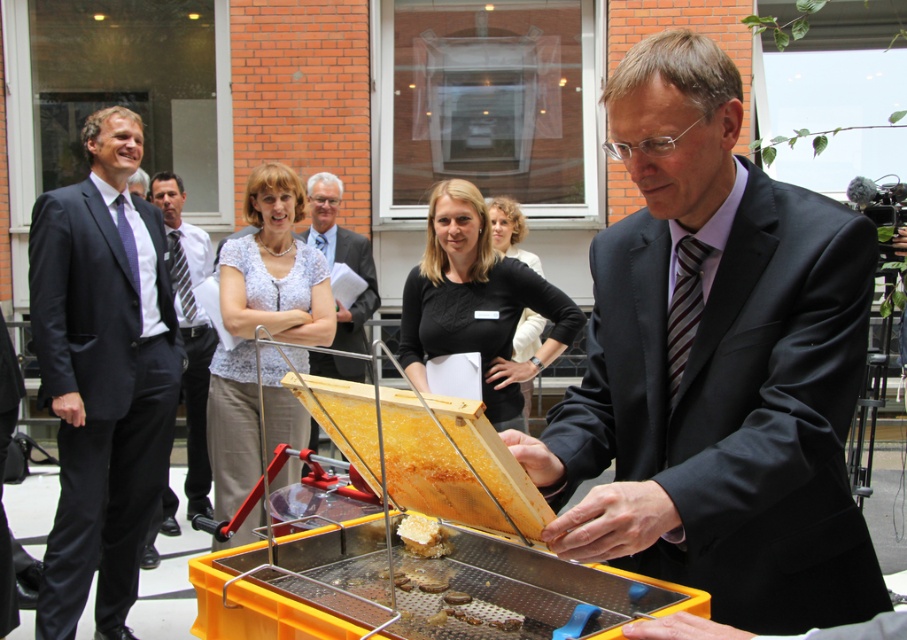
Is dark blue suit at left behind golden honeycomb at center?

Yes.

Can you confirm if dark blue suit at left is wider than golden honeycomb at center?

Indeed, dark blue suit at left has a greater width compared to golden honeycomb at center.

Find the location of a particular element. The width and height of the screenshot is (907, 640). dark blue suit at left is located at coordinates (102, 374).

Between dark blue suit at left and yellow honeycomb at center, which one has more height?

Standing taller between the two is dark blue suit at left.

Identify the location of dark blue suit at left. The height and width of the screenshot is (640, 907). (102, 374).

Who is more distant from viewer, (x=132, y=458) or (x=427, y=532)?

The point (x=132, y=458) is more distant.

The image size is (907, 640). In order to click on dark blue suit at left in this screenshot , I will do `click(102, 374)`.

Which of these two, white lace blouse at center or yellow honeycomb at center, stands taller?

With more height is white lace blouse at center.

Can you confirm if white lace blouse at center is positioned above yellow honeycomb at center?

Yes.

Between point (290, 468) and point (407, 534), which one is positioned behind?

The point (290, 468) is more distant.

Image resolution: width=907 pixels, height=640 pixels. I want to click on white lace blouse at center, so click(260, 321).